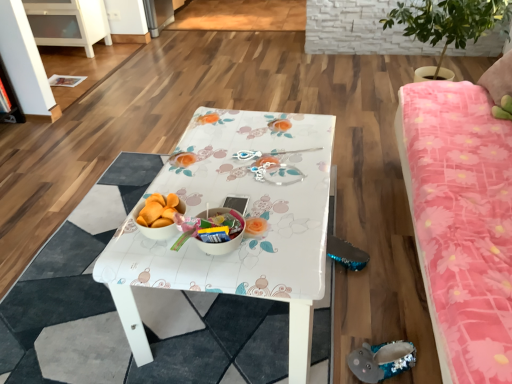
In order to click on white glossy cabinet at upper left in this screenshot , I will do click(x=68, y=23).

Measure the distance between point (384, 350) and camera.

1.30 meters.

Describe the element at coordinates (248, 215) in the screenshot. I see `white glossy table at center` at that location.

In order to face white glossy table at center, should I rotate leftwards or rightwards?

Turn left approximately 1.374 degrees to face it.

This screenshot has height=384, width=512. Describe the element at coordinates (230, 233) in the screenshot. I see `white glossy bowl at center` at that location.

Where is `white glossy bowl at center`? Image resolution: width=512 pixels, height=384 pixels. white glossy bowl at center is located at coordinates (230, 233).

Where is `white glossy cabinet at upper left`? The width and height of the screenshot is (512, 384). white glossy cabinet at upper left is located at coordinates pos(68,23).

Which is more to the left, white glossy bowl at center or green leafy plant at upper right?

white glossy bowl at center is more to the left.

From the image's perspective, does white glossy bowl at center appear lower than green leafy plant at upper right?

Correct, white glossy bowl at center appears lower than green leafy plant at upper right in the image.

Considering the points (214, 249) and (449, 6), which point is in front, point (214, 249) or point (449, 6)?

The point (214, 249) is closer.

Is white glossy bowl at center turned away from green leafy plant at upper right?

No, white glossy bowl at center is not facing the opposite direction of green leafy plant at upper right.

Is sequined gray slipper at lower right not within green leafy plant at upper right?

sequined gray slipper at lower right lies outside green leafy plant at upper right's area.

Can you confirm if sequined gray slipper at lower right is positioned to the right of green leafy plant at upper right?

Incorrect, sequined gray slipper at lower right is not on the right side of green leafy plant at upper right.

From the image's perspective, is sequined gray slipper at lower right located above green leafy plant at upper right?

No, from the image's perspective, sequined gray slipper at lower right is not on top of green leafy plant at upper right.

Is sequined gray slipper at lower right far away from green leafy plant at upper right?

sequined gray slipper at lower right is positioned a significant distance from green leafy plant at upper right.

Which of these two, white glossy cabinet at upper left or white glossy table at center, is smaller?

white glossy cabinet at upper left.

Considering the relative positions of white glossy cabinet at upper left and white glossy table at center in the image provided, is white glossy cabinet at upper left to the left of white glossy table at center from the viewer's perspective?

Correct, you'll find white glossy cabinet at upper left to the left of white glossy table at center.

Is white glossy cabinet at upper left positioned beyond the bounds of white glossy table at center?

Absolutely, white glossy cabinet at upper left is external to white glossy table at center.

Which of these two, white glossy cabinet at upper left or white glossy table at center, is thinner?

Thinner between the two is white glossy cabinet at upper left.

Considering the positions of objects white glossy bowl at center and sequined gray slipper at lower right in the image provided, who is more to the right, white glossy bowl at center or sequined gray slipper at lower right?

Positioned to the right is sequined gray slipper at lower right.

Is white glossy bowl at center facing away from sequined gray slipper at lower right?

white glossy bowl at center is not turned away from sequined gray slipper at lower right.

From the image's perspective, is white glossy bowl at center positioned above or below sequined gray slipper at lower right?

From the image's perspective, white glossy bowl at center appears above sequined gray slipper at lower right.

Which of these two, white glossy bowl at center or sequined gray slipper at lower right, stands taller?

white glossy bowl at center is taller.

Looking at their sizes, would you say white glossy table at center is wider or thinner than white glossy bowl at center?

In the image, white glossy table at center appears to be wider than white glossy bowl at center.

Can you tell me how much white glossy table at center and white glossy bowl at center differ in facing direction?

They differ by 3.5e-05 degrees in their facing directions.

Is point (284, 207) positioned in front of point (230, 248)?

No, (284, 207) is further to viewer.

Would you say white glossy table at center is inside or outside white glossy bowl at center?

white glossy table at center exists outside the volume of white glossy bowl at center.

Which object is further away from the camera taking this photo, white glossy table at center or sequined gray slipper at lower right?

sequined gray slipper at lower right is more distant.

Between white glossy table at center and sequined gray slipper at lower right, which one has larger size?

With larger size is white glossy table at center.

Find the location of a particular element. This screenshot has height=384, width=512. desk in front of the sequined gray slipper at lower right is located at coordinates (248, 215).

From the picture: Based on their positions, is white glossy table at center located to the left or right of sequined gray slipper at lower right?

From the image, it's evident that white glossy table at center is to the left of sequined gray slipper at lower right.

Does white glossy table at center have a smaller size compared to green leafy plant at upper right?

Correct, white glossy table at center occupies less space than green leafy plant at upper right.

Is white glossy table at center oriented away from green leafy plant at upper right?

white glossy table at center is not turned away from green leafy plant at upper right.

Find the location of a particular element. houseplant that is above the white glossy table at center (from the image's perspective) is located at coordinates (449, 21).

Is white glossy table at center placed right next to green leafy plant at upper right?

No, white glossy table at center is not with green leafy plant at upper right.

Find the location of a particular element. The image size is (512, 384). glass bowl in front of the green leafy plant at upper right is located at coordinates (230, 233).

The image size is (512, 384). Find the location of `houseplant above the sequined gray slipper at lower right (from a real-world perspective)`. houseplant above the sequined gray slipper at lower right (from a real-world perspective) is located at coordinates (449, 21).

Looking at the image, which one is located closer to pink floral fabric studio couch at right, sequined gray slipper at lower right or white glossy table at center?

Based on the image, white glossy table at center appears to be nearer to pink floral fabric studio couch at right.

Which object lies nearer to the anchor point white glossy bowl at center, white glossy cabinet at upper left or green leafy plant at upper right?

green leafy plant at upper right is closer to white glossy bowl at center.

Looking at the image, which one is located further to white glossy cabinet at upper left, white glossy bowl at center or green leafy plant at upper right?

white glossy bowl at center is positioned further to the anchor white glossy cabinet at upper left.

Which object lies nearer to the anchor point white glossy cabinet at upper left, pink floral fabric studio couch at right or white glossy table at center?

The object closer to white glossy cabinet at upper left is white glossy table at center.

Considering their positions, is green leafy plant at upper right positioned further to white glossy cabinet at upper left than sequined gray slipper at lower right?

sequined gray slipper at lower right is further to white glossy cabinet at upper left.

Based on their spatial positions, is green leafy plant at upper right or pink floral fabric studio couch at right closer to white glossy cabinet at upper left?

green leafy plant at upper right is closer to white glossy cabinet at upper left.

Which object lies nearer to the anchor point pink floral fabric studio couch at right, white glossy bowl at center or white glossy cabinet at upper left?

white glossy bowl at center is positioned closer to the anchor pink floral fabric studio couch at right.

From the image, which object appears to be nearer to white glossy table at center, white glossy bowl at center or green leafy plant at upper right?

→ white glossy bowl at center is positioned closer to the anchor white glossy table at center.

I want to click on studio couch between white glossy cabinet at upper left and green leafy plant at upper right in the horizontal direction, so click(x=461, y=227).

The width and height of the screenshot is (512, 384). In order to click on glass bowl between white glossy cabinet at upper left and green leafy plant at upper right in the horizontal direction in this screenshot , I will do `click(230, 233)`.

The height and width of the screenshot is (384, 512). I want to click on glass bowl between pink floral fabric studio couch at right and white glossy cabinet at upper left from front to back, so click(230, 233).

Find the location of `desk between white glossy bowl at center and green leafy plant at upper right in the horizontal direction`. desk between white glossy bowl at center and green leafy plant at upper right in the horizontal direction is located at coordinates (248, 215).